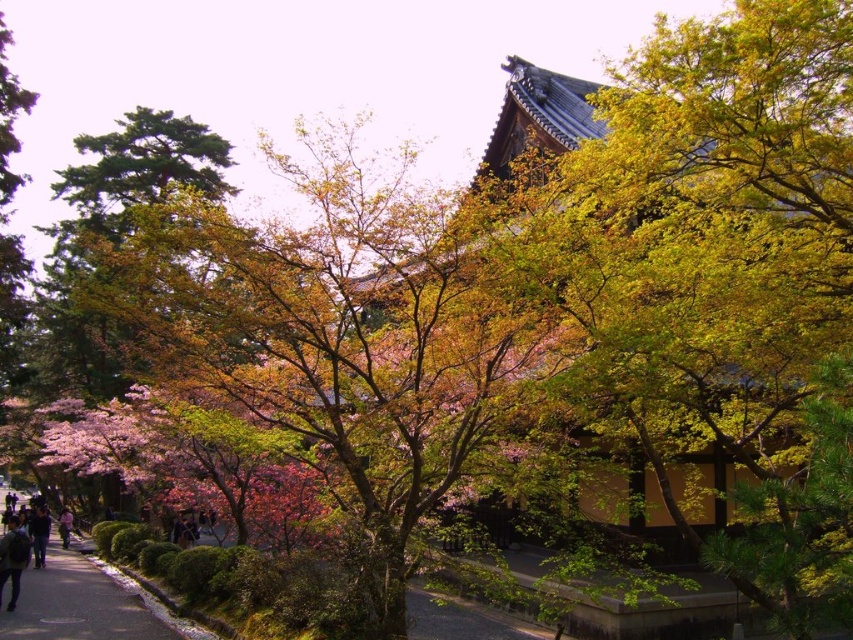
You are standing in front of the traditional Japanese building and notice two items at the lower left corner of your view. The items are dark blue jeans at lower left and pink fabric at lower left. Which one appears taller in the scene?

The dark blue jeans at lower left appears taller than the pink fabric at lower left.

You are standing in the serene Japanese temple scene and notice two items at the lower left corner. The dark blue jeans at lower left and the pink fabric at lower left. Which item takes up more horizontal space in the image?

The dark blue jeans at lower left takes up more horizontal space than the pink fabric at lower left because its width surpasses the pink fabric at lower left.

You are a delivery person with a cart that is 1.2 meters wide. You need to navigate through the scene shown in the image. Can you pass through the area near the paved asphalt sidewalk at lower left and the pink fabric at lower left without your cart getting stuck?

The paved asphalt sidewalk at lower left might be wider than pink fabric at lower left. However, since the exact width of the sidewalk and fabric are not provided, it is uncertain whether the 1.2 meter wide cart can pass safely. Proceed with caution and assess the space on site.